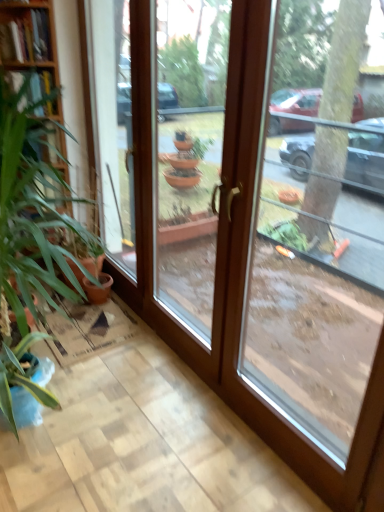
The height and width of the screenshot is (512, 384). What are the coordinates of `green leafy plant at left` in the screenshot? It's located at (31, 231).

At what (x,y) coordinates should I click in order to perform the action: click on wooden bookshelf at left. Please return your answer as a coordinate pair (x, y). This screenshot has width=384, height=512. Looking at the image, I should click on (29, 42).

The height and width of the screenshot is (512, 384). I want to click on green leafy plant at left, so click(31, 231).

Does point (29, 67) lie in front of point (27, 290)?

No, it is behind (27, 290).

Image resolution: width=384 pixels, height=512 pixels. In order to click on bookshelf above the green leafy plant at left (from a real-world perspective) in this screenshot , I will do `click(29, 42)`.

Which of these two, wooden bookshelf at left or green leafy plant at left, stands shorter?

green leafy plant at left is shorter.

Relative to green leafy plant at left, is wooden bookshelf at left in front or behind?

Visually, wooden bookshelf at left is located behind green leafy plant at left.

Which of these two, green leafy plant at left or wooden bookshelf at left, is bigger?

Bigger between the two is green leafy plant at left.

From a real-world perspective, who is located higher, green leafy plant at left or wooden bookshelf at left?

wooden bookshelf at left is physically above.

Locate an element on the screen. Image resolution: width=384 pixels, height=512 pixels. bookshelf above the green leafy plant at left (from the image's perspective) is located at coordinates (29, 42).

Between green leafy plant at left and transparent glass door at right, positioned as the 1th window in right-to-left order, which one is positioned behind?

green leafy plant at left is further from the camera.

Measure the distance from green leafy plant at left to transparent glass door at right, acting as the 2th window starting from the left.

38.72 inches.

At what (x,y) coordinates should I click in order to perform the action: click on the 2nd window counting from the right side of the green leafy plant at left. Please return your answer as a coordinate pair (x, y). The image size is (384, 512). Looking at the image, I should click on (247, 296).

From the image's perspective, is transparent glass door at right, positioned as the 1th window in right-to-left order, beneath transparent glass door at center, positioned as the 2th window in right-to-left order?

Yes, from the image's perspective, transparent glass door at right, positioned as the 1th window in right-to-left order, is below transparent glass door at center, positioned as the 2th window in right-to-left order.

What's the angular difference between transparent glass door at right, positioned as the 1th window in right-to-left order, and transparent glass door at center, the first window when ordered from left to right,'s facing directions?

The facing directions of transparent glass door at right, positioned as the 1th window in right-to-left order, and transparent glass door at center, the first window when ordered from left to right, are 0.266 degrees apart.

Is transparent glass door at right, acting as the 2th window starting from the left, far from transparent glass door at center, positioned as the 2th window in right-to-left order?

Yes, transparent glass door at right, acting as the 2th window starting from the left, and transparent glass door at center, positioned as the 2th window in right-to-left order, are located far from each other.

Considering the sizes of objects transparent glass door at right, positioned as the 1th window in right-to-left order, and transparent glass door at center, the first window when ordered from left to right, in the image provided, who is wider, transparent glass door at right, positioned as the 1th window in right-to-left order, or transparent glass door at center, the first window when ordered from left to right,?

transparent glass door at right, positioned as the 1th window in right-to-left order.

Is point (9, 69) closer or farther from the camera than point (228, 330)?

Point (9, 69) appears to be farther away from the viewer than point (228, 330).

Is wooden bookshelf at left behind transparent glass door at right, positioned as the 1th window in right-to-left order?

Yes, wooden bookshelf at left is further from the viewer.

From a real-world perspective, which is physically below, wooden bookshelf at left or transparent glass door at right, positioned as the 1th window in right-to-left order?

From a 3D spatial view, transparent glass door at right, positioned as the 1th window in right-to-left order, is below.

From the image's perspective, relative to transparent glass door at right, positioned as the 1th window in right-to-left order, is wooden bookshelf at left above or below?

Clearly, from the image's perspective, wooden bookshelf at left is above transparent glass door at right, positioned as the 1th window in right-to-left order.

Is green leafy plant at left oriented towards transparent glass door at center, the first window when ordered from left to right?

Yes, green leafy plant at left is turned towards transparent glass door at center, the first window when ordered from left to right.

Is the depth of green leafy plant at left greater than that of transparent glass door at center, positioned as the 2th window in right-to-left order?

Yes, it is behind transparent glass door at center, positioned as the 2th window in right-to-left order.

Is green leafy plant at left beside transparent glass door at center, positioned as the 2th window in right-to-left order?

No, green leafy plant at left is not touching transparent glass door at center, positioned as the 2th window in right-to-left order.

In the scene shown: Could you tell me if transparent glass door at right, acting as the 2th window starting from the left, is turned towards wooden bookshelf at left?

No, transparent glass door at right, acting as the 2th window starting from the left, is not oriented towards wooden bookshelf at left.

At what (x,y) coordinates should I click in order to perform the action: click on window that is the 2nd object located below the wooden bookshelf at left (from the image's perspective). Please return your answer as a coordinate pair (x, y). This screenshot has width=384, height=512. Looking at the image, I should click on (247, 296).

Is wooden bookshelf at left completely or partially inside transparent glass door at right, acting as the 2th window starting from the left?

No, wooden bookshelf at left is not surrounded by transparent glass door at right, acting as the 2th window starting from the left.

Where is `houseplant lying on the right of wooden bookshelf at left`? The height and width of the screenshot is (512, 384). houseplant lying on the right of wooden bookshelf at left is located at coordinates (31, 231).

Locate an element on the screen. This screenshot has width=384, height=512. bookshelf that appears above the green leafy plant at left (from the image's perspective) is located at coordinates (29, 42).

Looking at the image, which one is located closer to transparent glass door at right, positioned as the 1th window in right-to-left order, wooden bookshelf at left or green leafy plant at left?

green leafy plant at left.

Considering their positions, is green leafy plant at left positioned further to wooden bookshelf at left than transparent glass door at right, acting as the 2th window starting from the left?

transparent glass door at right, acting as the 2th window starting from the left, is further to wooden bookshelf at left.

Considering their positions, is transparent glass door at right, acting as the 2th window starting from the left, positioned further to wooden bookshelf at left than transparent glass door at center, the first window when ordered from left to right?

Based on the image, transparent glass door at right, acting as the 2th window starting from the left, appears to be further to wooden bookshelf at left.

Which object lies further to the anchor point transparent glass door at right, acting as the 2th window starting from the left, green leafy plant at left or transparent glass door at center, positioned as the 2th window in right-to-left order?

transparent glass door at center, positioned as the 2th window in right-to-left order.

Considering their positions, is transparent glass door at center, positioned as the 2th window in right-to-left order, positioned further to transparent glass door at right, positioned as the 1th window in right-to-left order, than green leafy plant at left?

transparent glass door at center, positioned as the 2th window in right-to-left order, is positioned further to the anchor transparent glass door at right, positioned as the 1th window in right-to-left order.

Estimate the real-world distances between objects in this image. Which object is further from transparent glass door at right, acting as the 2th window starting from the left, transparent glass door at center, the first window when ordered from left to right, or wooden bookshelf at left?

wooden bookshelf at left is further to transparent glass door at right, acting as the 2th window starting from the left.

Looking at the image, which one is located further to transparent glass door at center, the first window when ordered from left to right, green leafy plant at left or transparent glass door at right, acting as the 2th window starting from the left?

transparent glass door at right, acting as the 2th window starting from the left, lies further to transparent glass door at center, the first window when ordered from left to right, than the other object.

Considering their positions, is transparent glass door at center, the first window when ordered from left to right, positioned closer to wooden bookshelf at left than transparent glass door at right, positioned as the 1th window in right-to-left order?

transparent glass door at center, the first window when ordered from left to right, lies closer to wooden bookshelf at left than the other object.

Locate an element on the screen. window between transparent glass door at right, acting as the 2th window starting from the left, and wooden bookshelf at left from front to back is located at coordinates (189, 152).

Find the location of `houseplant between wooden bookshelf at left and transparent glass door at right, acting as the 2th window starting from the left, from left to right`. houseplant between wooden bookshelf at left and transparent glass door at right, acting as the 2th window starting from the left, from left to right is located at coordinates (31, 231).

You are a GUI agent. You are given a task and a screenshot of the screen. Output one action in this format:
    pyautogui.click(x=<x>, y=<y>)
    Task: Click on the window situated between green leafy plant at left and transparent glass door at right, positioned as the 1th window in right-to-left order, from left to right
    This screenshot has width=384, height=512.
    Given the screenshot: What is the action you would take?
    pyautogui.click(x=189, y=152)

This screenshot has width=384, height=512. Find the location of `houseplant situated between wooden bookshelf at left and transparent glass door at center, positioned as the 2th window in right-to-left order, from left to right`. houseplant situated between wooden bookshelf at left and transparent glass door at center, positioned as the 2th window in right-to-left order, from left to right is located at coordinates (31, 231).